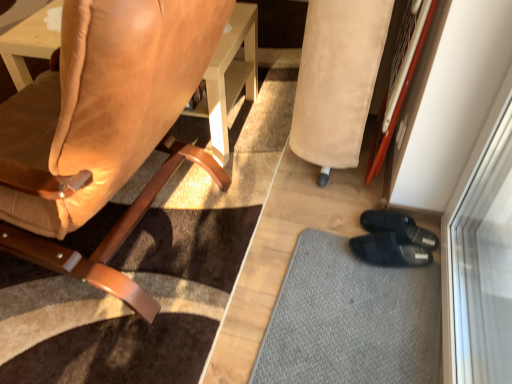
The height and width of the screenshot is (384, 512). Identify the location of vacant space situated above gray textured mat at lower right (from a real-world perspective). (360, 299).